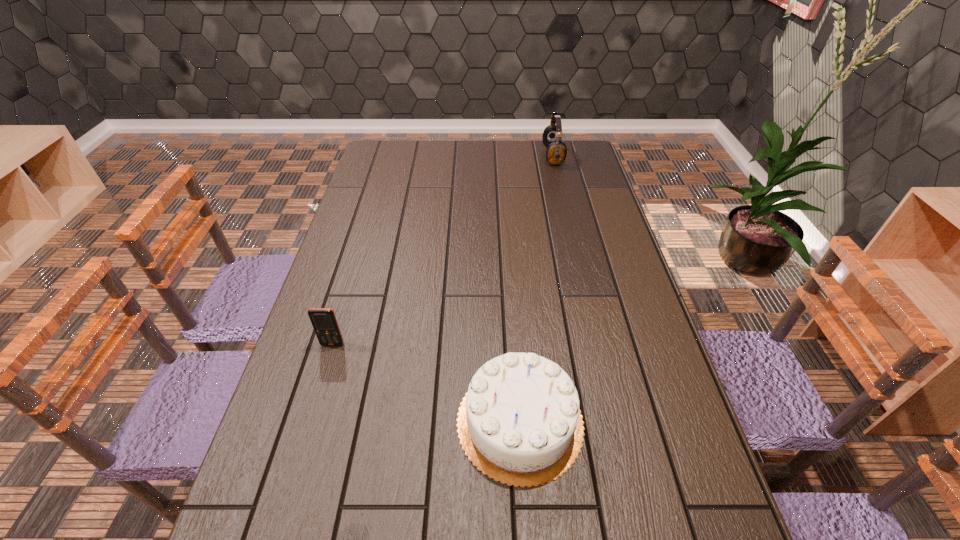
Find the location of a particular element. This screenshot has height=540, width=960. free space between the leftmost object and the rightmost object is located at coordinates (443, 250).

The height and width of the screenshot is (540, 960). I want to click on free space that is in between the shortest object and the farthest object, so click(443, 250).

The image size is (960, 540). I want to click on empty space between the leftmost object and the nearest object, so click(426, 383).

The height and width of the screenshot is (540, 960). I want to click on free space that is in between the birthday cake and the second farthest object, so click(x=426, y=383).

The width and height of the screenshot is (960, 540). I want to click on object that is the second closest to the second farthest object, so click(x=556, y=153).

The width and height of the screenshot is (960, 540). I want to click on object that stands as the second closest to the shortest object, so click(556, 153).

This screenshot has height=540, width=960. I want to click on vacant space that satisfies the following two spatial constraints: 1. on the screen of the nearest object; 2. on the right side of the cellular telephone, so 309,422.

Identify the location of free space that satisfies the following two spatial constraints: 1. on the ear cups of the rightmost object; 2. on the screen of the second nearest object. This screenshot has height=540, width=960. (598, 344).